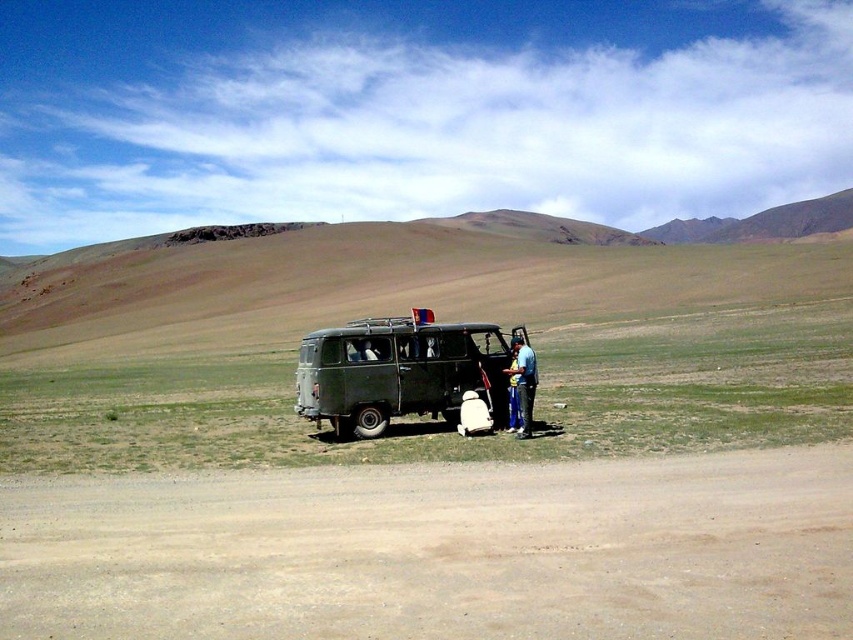
You are planning to place a small picnic basket on the ground between the brown sandy dirt at lower center and the blue fabric bag at center. Based on their sizes, which location would provide more space for the basket?

The brown sandy dirt at lower center has a larger size compared to the blue fabric bag at center, so placing the picnic basket on the brown sandy dirt at lower center would provide more space.

You are standing at the starting point of the dirt road in the foreground. You need to reach the matte green van at center. Which direction should you head towards?

The matte green van at center is located at point (398, 372), so you should head towards the center of the image from the starting point of the dirt road to reach it.

You are a hiker trying to decide whether to park your vehicle on the brown sandy dirt at lower center or the matte green van at center. Based on the height difference between them, which location would provide a better vantage point for viewing the surrounding landscape?

The matte green van at center is taller than the brown sandy dirt at lower center, so parking on the matte green van at center would provide a better vantage point for viewing the surrounding landscape.